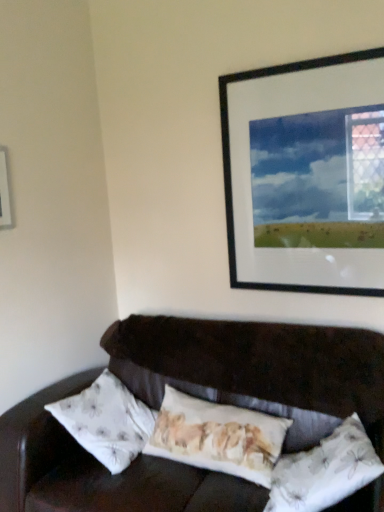
Question: In which direction should I rotate to look at floral fabric pillow at center, positioned as the 2th pillow in right-to-left order?

Choices:
 (A) right
 (B) left

Answer: (A)

Question: Is white plastic picture frame at upper left, the 1th picture frame from the left, a part of white floral fabric pillow at lower right, the 2th pillow when ordered from left to right?

Choices:
 (A) yes
 (B) no

Answer: (B)

Question: Considering the relative positions of white floral fabric pillow at lower right, the 2th pillow when ordered from left to right, and white plastic picture frame at upper left, placed as the second picture frame when sorted from right to left, in the image provided, is white floral fabric pillow at lower right, the 2th pillow when ordered from left to right, to the left of white plastic picture frame at upper left, placed as the second picture frame when sorted from right to left, from the viewer's perspective?

Choices:
 (A) yes
 (B) no

Answer: (B)

Question: Does white floral fabric pillow at lower right, which is the 1th pillow in right-to-left order, have a greater width compared to white plastic picture frame at upper left, placed as the second picture frame when sorted from right to left?

Choices:
 (A) yes
 (B) no

Answer: (A)

Question: From the image's perspective, is white floral fabric pillow at lower right, the 2th pillow when ordered from left to right, beneath white plastic picture frame at upper left, the 1th picture frame from the left?

Choices:
 (A) yes
 (B) no

Answer: (A)

Question: From the image's perspective, is white floral fabric pillow at lower right, the 2th pillow when ordered from left to right, located above white plastic picture frame at upper left, placed as the second picture frame when sorted from right to left?

Choices:
 (A) yes
 (B) no

Answer: (B)

Question: Can you confirm if white floral fabric pillow at lower right, the 2th pillow when ordered from left to right, is taller than white plastic picture frame at upper left, placed as the second picture frame when sorted from right to left?

Choices:
 (A) no
 (B) yes

Answer: (B)

Question: Would you say black matte picture frame at upper right, marked as the first picture frame in a right-to-left arrangement, is part of white floral fabric pillow at lower right, which is the 1th pillow in right-to-left order,'s contents?

Choices:
 (A) yes
 (B) no

Answer: (B)

Question: Is white floral fabric pillow at lower right, which is the 1th pillow in right-to-left order, completely or partially outside of black matte picture frame at upper right, marked as the first picture frame in a right-to-left arrangement?

Choices:
 (A) yes
 (B) no

Answer: (A)

Question: Does white floral fabric pillow at lower right, which is the 1th pillow in right-to-left order, have a lesser height compared to black matte picture frame at upper right, marked as the first picture frame in a right-to-left arrangement?

Choices:
 (A) yes
 (B) no

Answer: (A)

Question: Does white floral fabric pillow at lower right, the 2th pillow when ordered from left to right, appear on the left side of black matte picture frame at upper right, which ranks as the second picture frame in left-to-right order?

Choices:
 (A) no
 (B) yes

Answer: (B)

Question: From the image's perspective, is white floral fabric pillow at lower right, which is the 1th pillow in right-to-left order, located above black matte picture frame at upper right, which ranks as the second picture frame in left-to-right order?

Choices:
 (A) no
 (B) yes

Answer: (A)

Question: From the image's perspective, does white floral fabric pillow at lower right, the 2th pillow when ordered from left to right, appear lower than black matte picture frame at upper right, marked as the first picture frame in a right-to-left arrangement?

Choices:
 (A) yes
 (B) no

Answer: (A)

Question: Can you confirm if floral fabric pillow at center, positioned as the 2th pillow in right-to-left order, is bigger than black matte picture frame at upper right, marked as the first picture frame in a right-to-left arrangement?

Choices:
 (A) yes
 (B) no

Answer: (A)